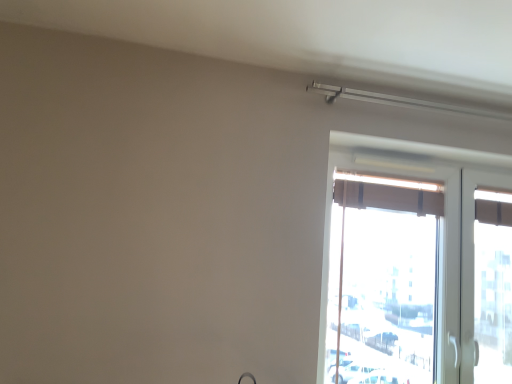
Question: From the image's perspective, is matte brown curtain at right under brown fabric curtain at upper right?

Choices:
 (A) yes
 (B) no

Answer: (A)

Question: Does matte brown curtain at right have a lesser height compared to brown fabric curtain at upper right?

Choices:
 (A) yes
 (B) no

Answer: (B)

Question: Is matte brown curtain at right positioned beyond the bounds of brown fabric curtain at upper right?

Choices:
 (A) no
 (B) yes

Answer: (B)

Question: Can you confirm if matte brown curtain at right is thinner than brown fabric curtain at upper right?

Choices:
 (A) yes
 (B) no

Answer: (B)

Question: Can you confirm if matte brown curtain at right is taller than brown fabric curtain at upper right?

Choices:
 (A) yes
 (B) no

Answer: (A)

Question: Is matte brown curtain at right looking in the opposite direction of brown fabric curtain at upper right?

Choices:
 (A) yes
 (B) no

Answer: (A)

Question: Are brown fabric curtain at upper right and matte brown curtain at right far apart?

Choices:
 (A) no
 (B) yes

Answer: (A)

Question: Can you confirm if brown fabric curtain at upper right is shorter than matte brown curtain at right?

Choices:
 (A) no
 (B) yes

Answer: (B)

Question: Is matte brown curtain at right at the back of brown fabric curtain at upper right?

Choices:
 (A) yes
 (B) no

Answer: (A)

Question: From a real-world perspective, is brown fabric curtain at upper right on top of matte brown curtain at right?

Choices:
 (A) yes
 (B) no

Answer: (A)

Question: Is matte brown curtain at right a part of brown fabric curtain at upper right?

Choices:
 (A) no
 (B) yes

Answer: (A)

Question: Is brown fabric curtain at upper right in front of matte brown curtain at right?

Choices:
 (A) no
 (B) yes

Answer: (A)

Question: Based on their positions, is matte brown curtain at right located to the left or right of brown fabric curtain at upper right?

Choices:
 (A) right
 (B) left

Answer: (A)